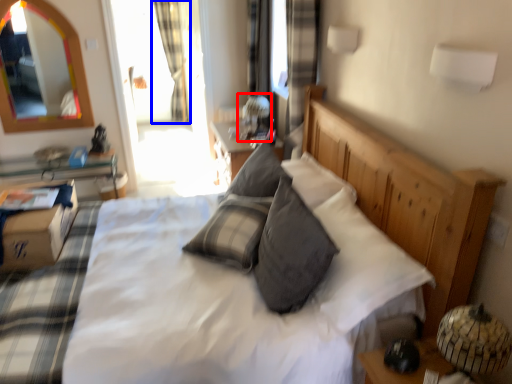
Question: Which point is further to the camera, table lamp (highlighted by a red box) or curtain (highlighted by a blue box)?

Choices:
 (A) table lamp
 (B) curtain

Answer: (B)